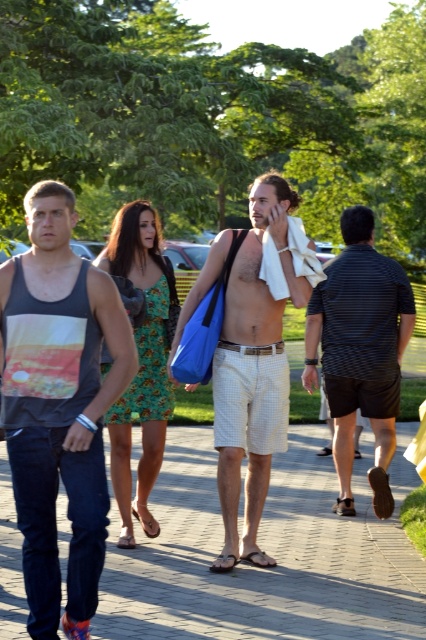
Who is more distant from viewer, [250,529] or [118,212]?

The point [118,212] is more distant.

Image resolution: width=426 pixels, height=640 pixels. I want to click on beige checkered shorts at center, so click(x=249, y=362).

Is dark gray tank top at left closer to camera compared to beige checkered shorts at center?

Yes.

Does point (40, 355) come in front of point (276, 406)?

Yes, point (40, 355) is in front of point (276, 406).

You are a GUI agent. You are given a task and a screenshot of the screen. Output one action in this format:
    pyautogui.click(x=<x>, y=<y>)
    Task: Click on the dark gray tank top at left
    
    Given the screenshot: What is the action you would take?
    pyautogui.click(x=58, y=404)

Can you confirm if brick pavement at center is thinner than striped cotton shirt at right?

No.

Can you confirm if brick pavement at center is positioned to the left of striped cotton shirt at right?

Correct, you'll find brick pavement at center to the left of striped cotton shirt at right.

Consider the image. Who is more forward, (x=337, y=516) or (x=359, y=278)?

Point (x=359, y=278) is more forward.

The height and width of the screenshot is (640, 426). What are the coordinates of `brick pavement at center` in the screenshot? It's located at (268, 552).